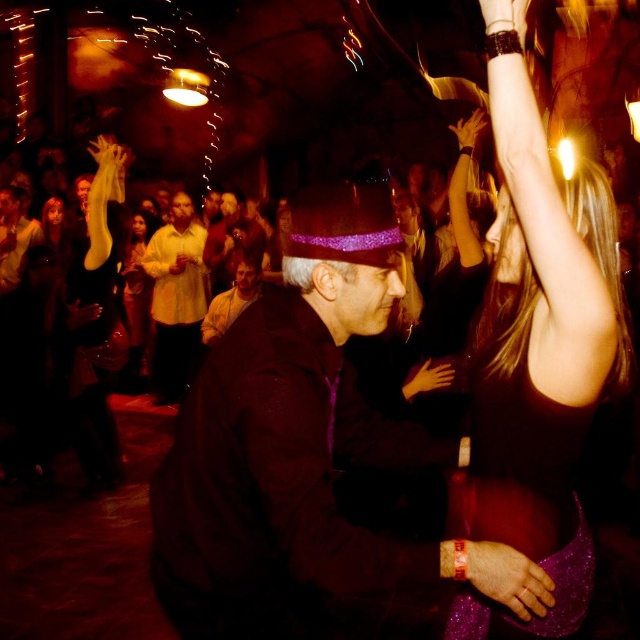
Based on the scene description, what color is the dress located at point (x=136, y=304)?

The dress at point (x=136, y=304) is matte yellow.

You are at a party and want to wear a hat and jacket similar to the ones in the image. Which item would require a smaller size, the purple velvet hat at center or the matte black jacket at left?

The purple velvet hat at center is smaller than the matte black jacket at left, so it would require a smaller size.